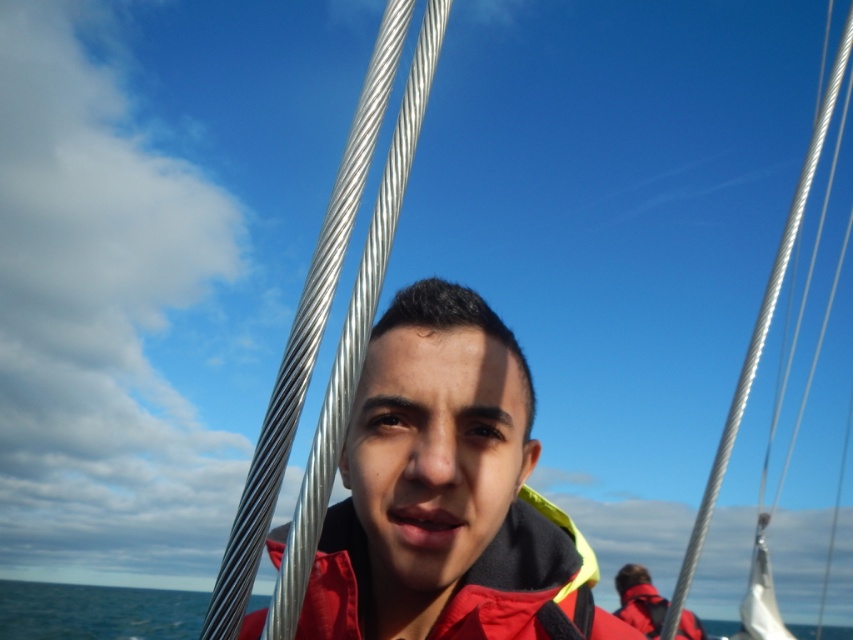
Question: Does blue water at lower left come behind red matte life jacket at lower right?

Choices:
 (A) yes
 (B) no

Answer: (B)

Question: Which point is closer to the camera taking this photo?

Choices:
 (A) (192, 628)
 (B) (703, 637)
 (C) (485, 552)

Answer: (C)

Question: Can you confirm if red matte jacket at center is positioned to the right of blue water at lower left?

Choices:
 (A) yes
 (B) no

Answer: (A)

Question: Which object appears closest to the camera in this image?

Choices:
 (A) blue water at lower left
 (B) red matte jacket at center
 (C) matte red jacket at center

Answer: (A)

Question: Can you confirm if blue water at lower left is positioned to the left of red matte life jacket at lower right?

Choices:
 (A) no
 (B) yes

Answer: (B)

Question: Which of the following is the farthest from the observer?

Choices:
 (A) (451, 621)
 (B) (654, 595)
 (C) (360, 160)

Answer: (B)